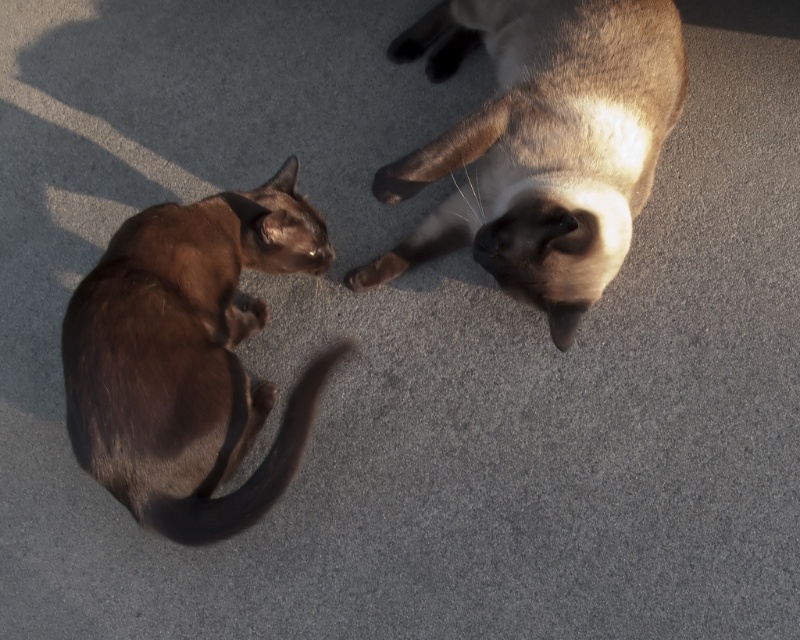
Based on the photo, based on the scene description, where is the satin brown cat at upper right located in terms of its 2D coordinates?

The satin brown cat at upper right is located at the 2D coordinates of point (541, 145).

You are a photographer trying to capture a photo of both cats. You notice two points marked in the image. The first point is at coordinates point (394,250) and the second is at point (276,467). To ensure both cats are in focus, you need to adjust your camera so that the point further away from the camera is in focus first. Which point should you focus on?

Point (394,250) is behind point (276,467), so you should focus on point (394,250) first to ensure both cats are in focus.